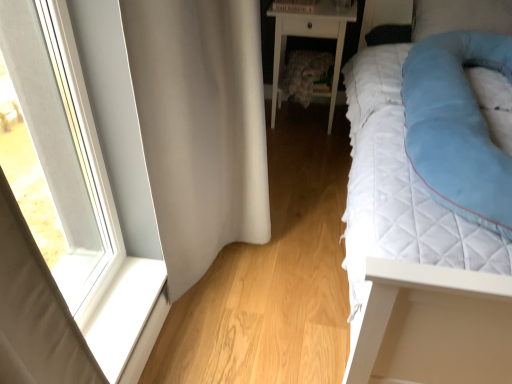
Find the location of a particular element. The height and width of the screenshot is (384, 512). free area below white glossy nightstand at center (from a real-world perspective) is located at coordinates (306, 123).